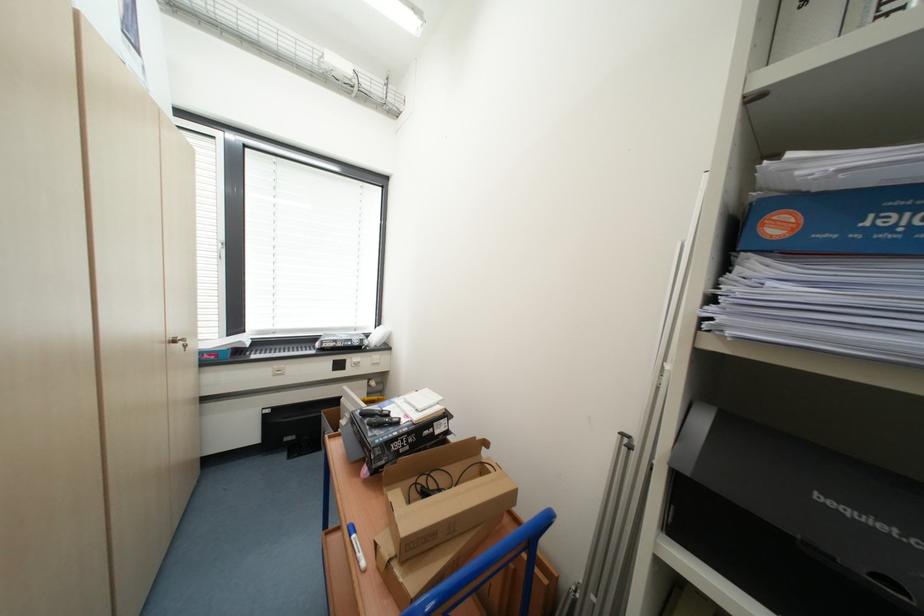
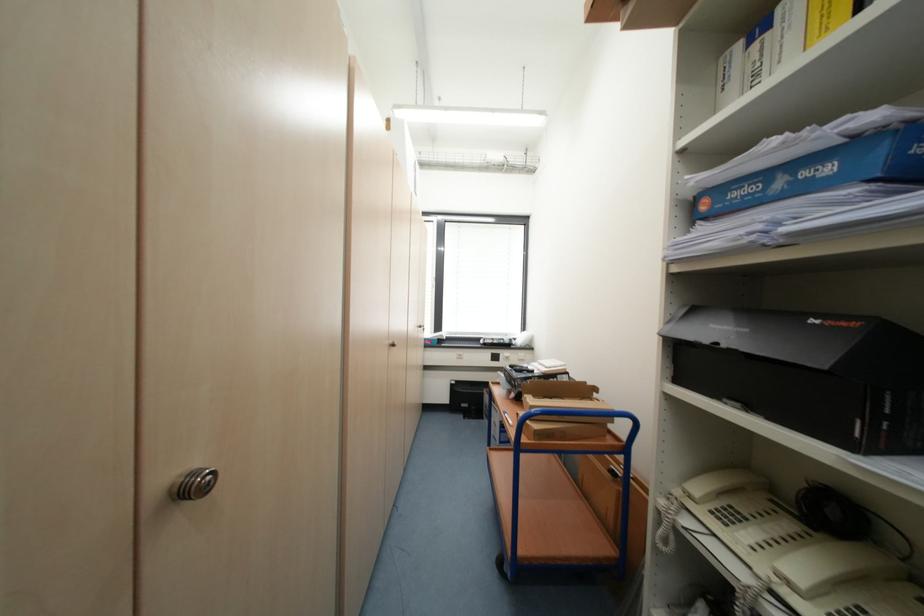
Where in the second image is the point corresponding to [825,499] from the first image?

(718, 326)